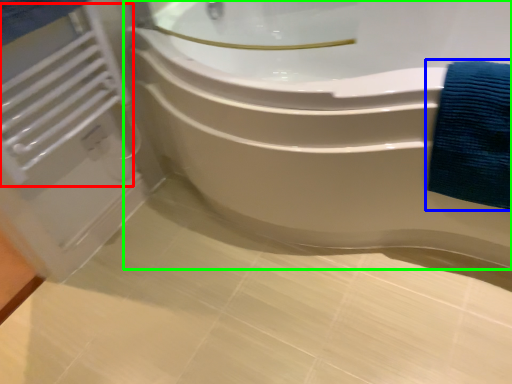
Question: Which object is positioned closest to radiator (highlighted by a red box)? Select from bath towel (highlighted by a blue box) and bathtub (highlighted by a green box).

Choices:
 (A) bath towel
 (B) bathtub

Answer: (B)